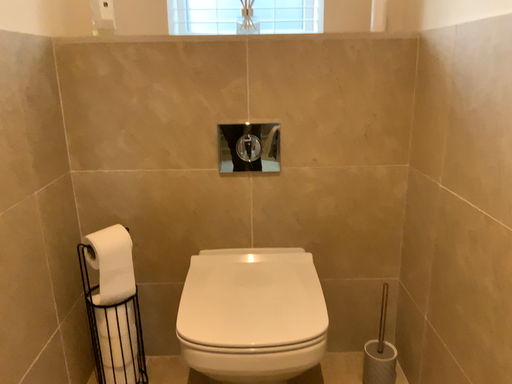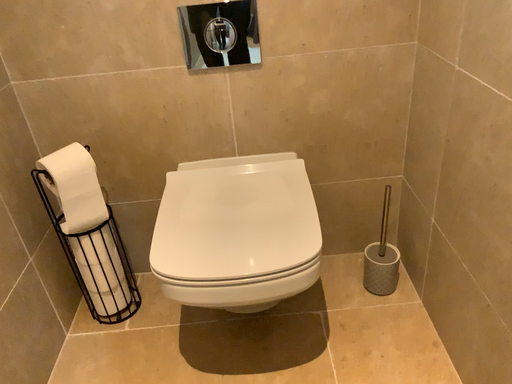
Question: Which way did the camera rotate in the video?

Choices:
 (A) rotated upward
 (B) rotated downward

Answer: (B)